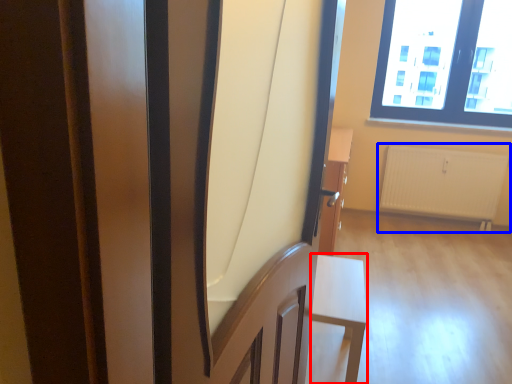
Question: Among these objects, which one is nearest to the camera, furniture (highlighted by a red box) or radiator (highlighted by a blue box)?

Choices:
 (A) furniture
 (B) radiator

Answer: (A)